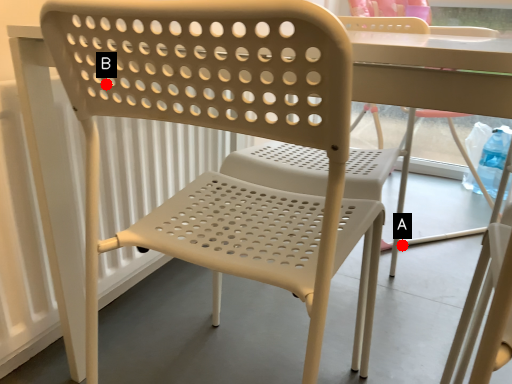
Question: Two points are circled on the image, labeled by A and B beside each circle. Which point is closer to the camera taking this photo?

Choices:
 (A) A is closer
 (B) B is closer

Answer: (B)